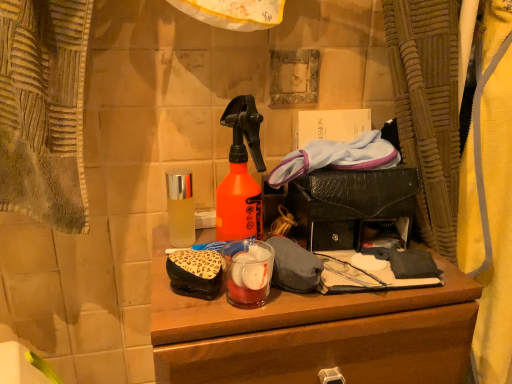
Question: From a real-world perspective, is leopard print fabric pouch at center over clear glass bottle at center?

Choices:
 (A) yes
 (B) no

Answer: (B)

Question: Considering the relative sizes of leopard print fabric pouch at center and clear glass bottle at center in the image provided, is leopard print fabric pouch at center bigger than clear glass bottle at center?

Choices:
 (A) no
 (B) yes

Answer: (B)

Question: Can you confirm if leopard print fabric pouch at center is positioned to the left of clear glass bottle at center?

Choices:
 (A) no
 (B) yes

Answer: (A)

Question: Is leopard print fabric pouch at center in front of clear glass bottle at center?

Choices:
 (A) yes
 (B) no

Answer: (A)

Question: Would you say leopard print fabric pouch at center contains clear glass bottle at center?

Choices:
 (A) yes
 (B) no

Answer: (B)

Question: Are leopard print fabric pouch at center and clear glass bottle at center making contact?

Choices:
 (A) no
 (B) yes

Answer: (A)

Question: From the image's perspective, does wooden desk at center appear lower than leopard print fabric pouch at center?

Choices:
 (A) yes
 (B) no

Answer: (A)

Question: Is wooden desk at center at the right side of leopard print fabric pouch at center?

Choices:
 (A) yes
 (B) no

Answer: (A)

Question: Does wooden desk at center have a lesser width compared to leopard print fabric pouch at center?

Choices:
 (A) yes
 (B) no

Answer: (B)

Question: Considering the relative positions of wooden desk at center and leopard print fabric pouch at center in the image provided, is wooden desk at center to the left of leopard print fabric pouch at center from the viewer's perspective?

Choices:
 (A) yes
 (B) no

Answer: (B)

Question: Is wooden desk at center turned away from leopard print fabric pouch at center?

Choices:
 (A) yes
 (B) no

Answer: (B)

Question: Are wooden desk at center and leopard print fabric pouch at center far apart?

Choices:
 (A) yes
 (B) no

Answer: (B)

Question: Is wooden desk at center completely or partially inside clear glass bottle at center?

Choices:
 (A) yes
 (B) no

Answer: (B)